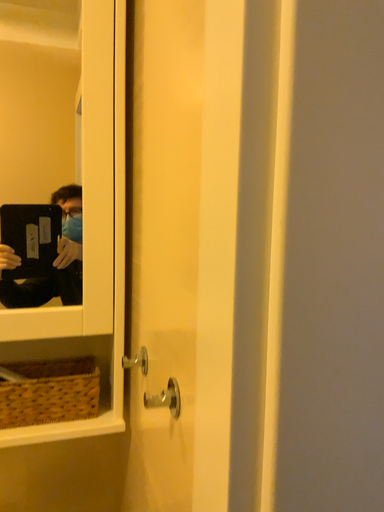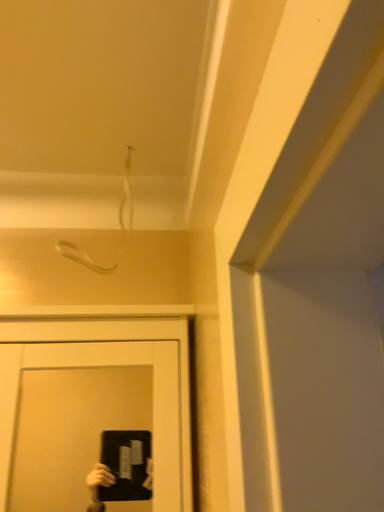
Question: How did the camera likely rotate when shooting the video?

Choices:
 (A) rotated right
 (B) rotated left

Answer: (B)